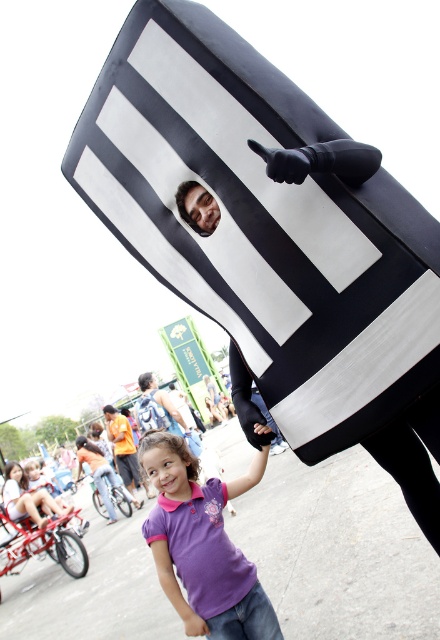
Where is `brushed metal backpack at lower center`? The width and height of the screenshot is (440, 640). brushed metal backpack at lower center is located at coordinates (157, 408).

In the scene shown: Who is taller, brushed metal backpack at lower center or smooth skin face at upper center?

brushed metal backpack at lower center

At what (x,y) coordinates should I click in order to perform the action: click on brushed metal backpack at lower center. Please return your answer as a coordinate pair (x, y). The image size is (440, 640). Looking at the image, I should click on (157, 408).

Is purple cotton shirt at center in front of orange fabric shirt at lower left?

Yes, it is in front of orange fabric shirt at lower left.

Consider the image. Does purple cotton shirt at center appear on the right side of orange fabric shirt at lower left?

Indeed, purple cotton shirt at center is positioned on the right side of orange fabric shirt at lower left.

Does point (228, 625) lie in front of point (128, 461)?

That is True.

Locate an element on the screen. The width and height of the screenshot is (440, 640). purple cotton shirt at center is located at coordinates (202, 545).

Who is positioned more to the right, black matte flag at upper center or orange fabric shirt at lower left?

black matte flag at upper center

Who is higher up, black matte flag at upper center or orange fabric shirt at lower left?

Positioned higher is black matte flag at upper center.

Describe the element at coordinates (261, 225) in the screenshot. I see `black matte flag at upper center` at that location.

Where is `black matte flag at upper center`? The height and width of the screenshot is (640, 440). black matte flag at upper center is located at coordinates (261, 225).